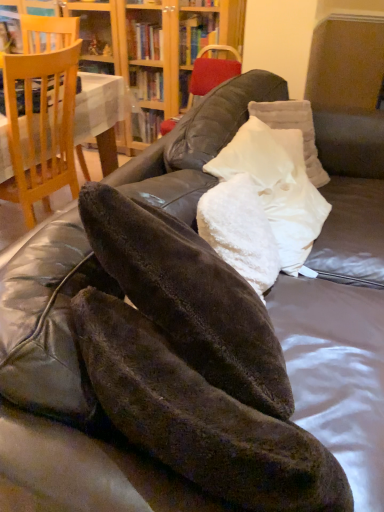
Question: From a real-world perspective, is white fluffy pillow at center, the 2th pillow when ordered from back to front, located higher than white fluffy pillow at center, the third pillow positioned from the back?

Choices:
 (A) yes
 (B) no

Answer: (A)

Question: Is white fluffy pillow at center, the 2th pillow when ordered from back to front, facing away from white fluffy pillow at center, the third pillow positioned from the back?

Choices:
 (A) yes
 (B) no

Answer: (B)

Question: Does white fluffy pillow at center, the 2th pillow when ordered from back to front, have a greater height compared to white fluffy pillow at center, marked as the first pillow in a front-to-back arrangement?

Choices:
 (A) yes
 (B) no

Answer: (A)

Question: Considering the relative sizes of white fluffy pillow at center, which is the second pillow from front to back, and white fluffy pillow at center, the third pillow positioned from the back, in the image provided, is white fluffy pillow at center, which is the second pillow from front to back, thinner than white fluffy pillow at center, the third pillow positioned from the back,?

Choices:
 (A) yes
 (B) no

Answer: (B)

Question: Considering the relative positions of white fluffy pillow at center, the 2th pillow when ordered from back to front, and white fluffy pillow at center, marked as the first pillow in a front-to-back arrangement, in the image provided, is white fluffy pillow at center, the 2th pillow when ordered from back to front, to the right of white fluffy pillow at center, marked as the first pillow in a front-to-back arrangement, from the viewer's perspective?

Choices:
 (A) yes
 (B) no

Answer: (A)

Question: Based on their sizes in the image, would you say white fluffy pillow at center, which is the second pillow from front to back, is bigger or smaller than wooden bookcase at upper center?

Choices:
 (A) big
 (B) small

Answer: (B)

Question: In terms of height, does white fluffy pillow at center, the 2th pillow when ordered from back to front, look taller or shorter compared to wooden bookcase at upper center?

Choices:
 (A) tall
 (B) short

Answer: (B)

Question: From the image's perspective, is white fluffy pillow at center, which is the second pillow from front to back, positioned above or below wooden bookcase at upper center?

Choices:
 (A) above
 (B) below

Answer: (B)

Question: Considering the positions of point (286, 237) and point (117, 26), is point (286, 237) closer or farther from the camera than point (117, 26)?

Choices:
 (A) closer
 (B) farther

Answer: (A)

Question: Relative to white fluffy pillow at center, the first pillow when ordered from back to front, is white fluffy pillow at center, marked as the first pillow in a front-to-back arrangement, in front or behind?

Choices:
 (A) front
 (B) behind

Answer: (A)

Question: Is point (276, 259) closer or farther from the camera than point (312, 125)?

Choices:
 (A) closer
 (B) farther

Answer: (A)

Question: Considering the positions of white fluffy pillow at center, marked as the first pillow in a front-to-back arrangement, and white fluffy pillow at center, the first pillow when ordered from back to front, in the image, is white fluffy pillow at center, marked as the first pillow in a front-to-back arrangement, bigger or smaller than white fluffy pillow at center, the first pillow when ordered from back to front,?

Choices:
 (A) small
 (B) big

Answer: (B)

Question: From a real-world perspective, relative to white fluffy pillow at center, acting as the 3th pillow starting from the front, is white fluffy pillow at center, marked as the first pillow in a front-to-back arrangement, vertically above or below?

Choices:
 (A) above
 (B) below

Answer: (A)

Question: Is light brown wooden chair at left bigger or smaller than white fluffy pillow at center, marked as the first pillow in a front-to-back arrangement?

Choices:
 (A) big
 (B) small

Answer: (A)

Question: Is light brown wooden chair at left to the left or to the right of white fluffy pillow at center, the third pillow positioned from the back, in the image?

Choices:
 (A) right
 (B) left

Answer: (B)